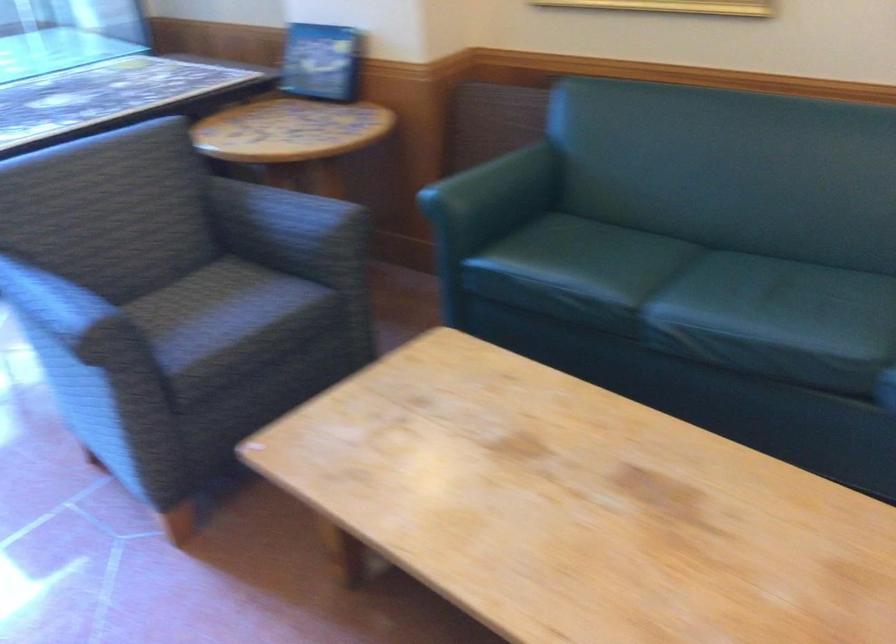
Describe the element at coordinates (224, 317) in the screenshot. Image resolution: width=896 pixels, height=644 pixels. I see `the chair sitting surface` at that location.